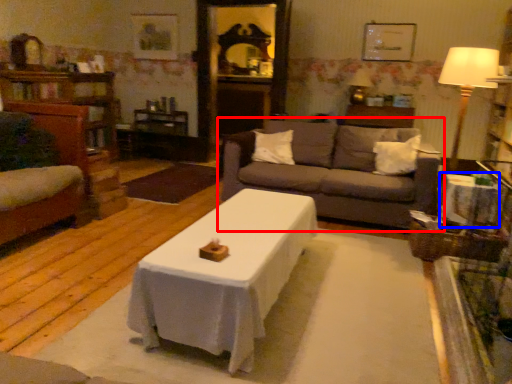
Question: Which of the following is the closest to the observer, studio couch (highlighted by a red box) or side table (highlighted by a blue box)?

Choices:
 (A) studio couch
 (B) side table

Answer: (B)